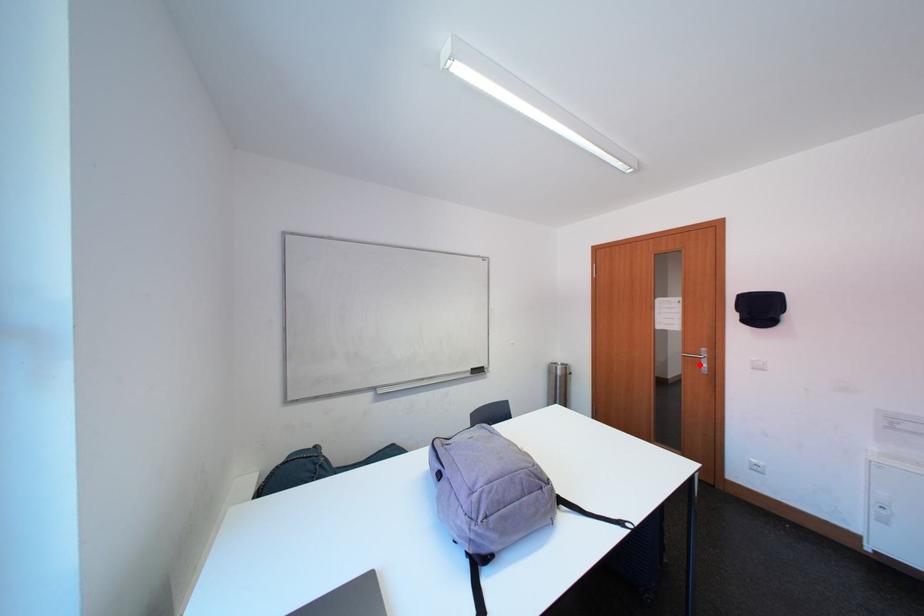
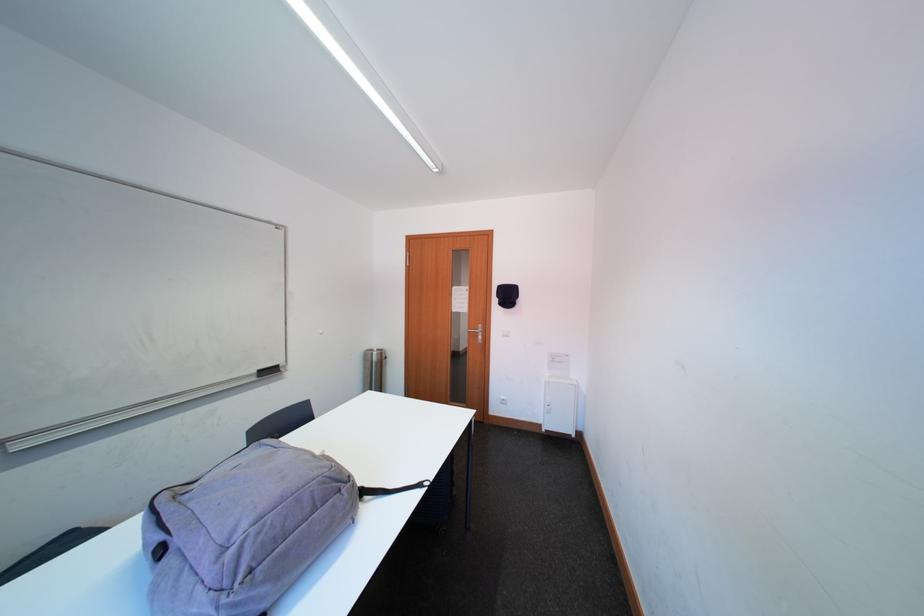
Question: I am providing you with two images of the same scene from different viewpoints. Given a red point in image1, look at the same physical point in image2. Is it:

Choices:
 (A) Closer to the viewpoint
 (B) Farther from the viewpoint

Answer: (B)